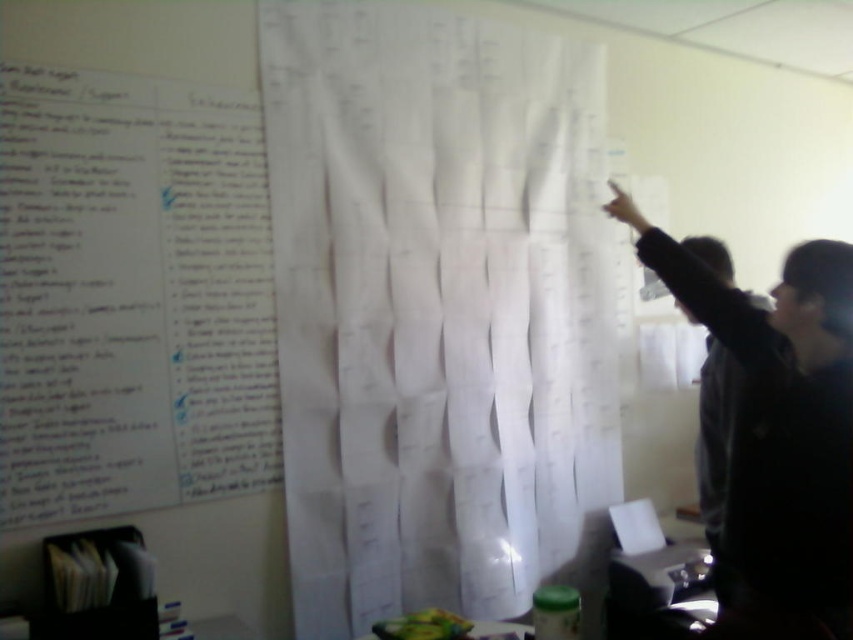
You are a visitor in the room and need to hang a new poster that is 28 inches wide between the white paper curtain at upper center and the black fabric at upper right. Can you fit the poster without overlapping either object?

The distance between the white paper curtain at upper center and the black fabric at upper right is 31.17 inches. Since the poster is 28 inches wide, there is enough space to fit it between them without overlapping either object.

Consider the image. You are standing in the office and notice the white paper curtain at upper center and the black fabric at upper right. Which object is closer to you?

The white paper curtain at upper center is closer to you because the black fabric at upper right is behind it.